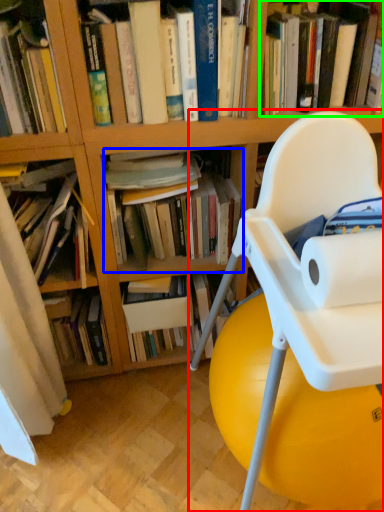
Question: Based on their relative distances, which object is farther from chair (highlighted by a red box)? Choose from book (highlighted by a blue box) and book (highlighted by a green box).

Choices:
 (A) book
 (B) book

Answer: (B)